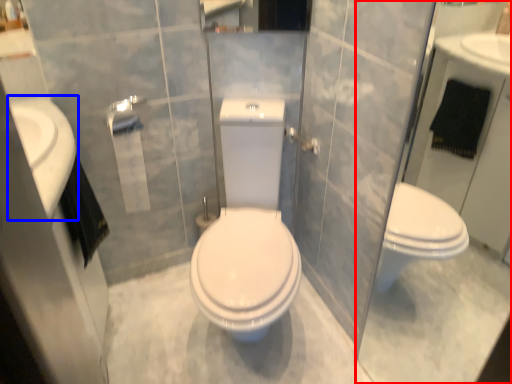
Question: Which point is further to the camera, glass door (highlighted by a red box) or sink (highlighted by a blue box)?

Choices:
 (A) glass door
 (B) sink

Answer: (B)